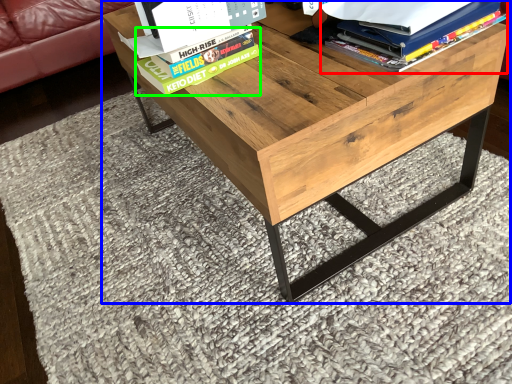
Question: Which object is positioned farthest from book (highlighted by a red box)? Select from table (highlighted by a blue box) and paperback book (highlighted by a green box).

Choices:
 (A) table
 (B) paperback book

Answer: (B)